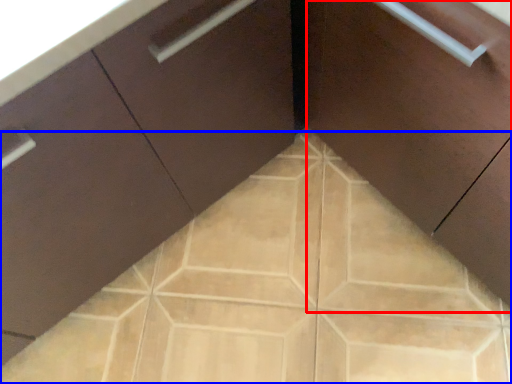
Question: Among these objects, which one is nearest to the camera, cabinetry (highlighted by a red box) or ceramic tile (highlighted by a blue box)?

Choices:
 (A) cabinetry
 (B) ceramic tile

Answer: (A)